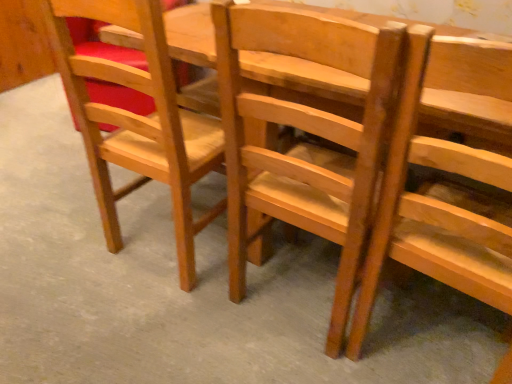
The image size is (512, 384). Find the location of `free space to the left of matte wood chair at left, which is the third chair in right-to-left order`. free space to the left of matte wood chair at left, which is the third chair in right-to-left order is located at coordinates (66, 241).